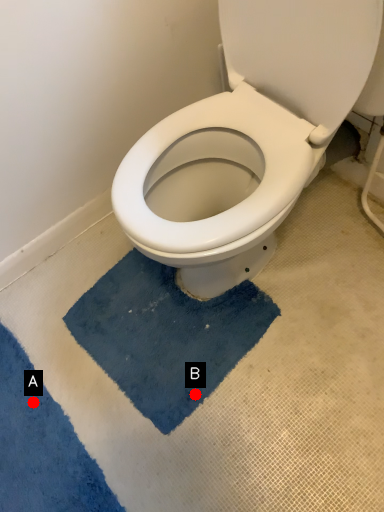
Question: Two points are circled on the image, labeled by A and B beside each circle. Which point is closer to the camera taking this photo?

Choices:
 (A) A is closer
 (B) B is closer

Answer: (B)